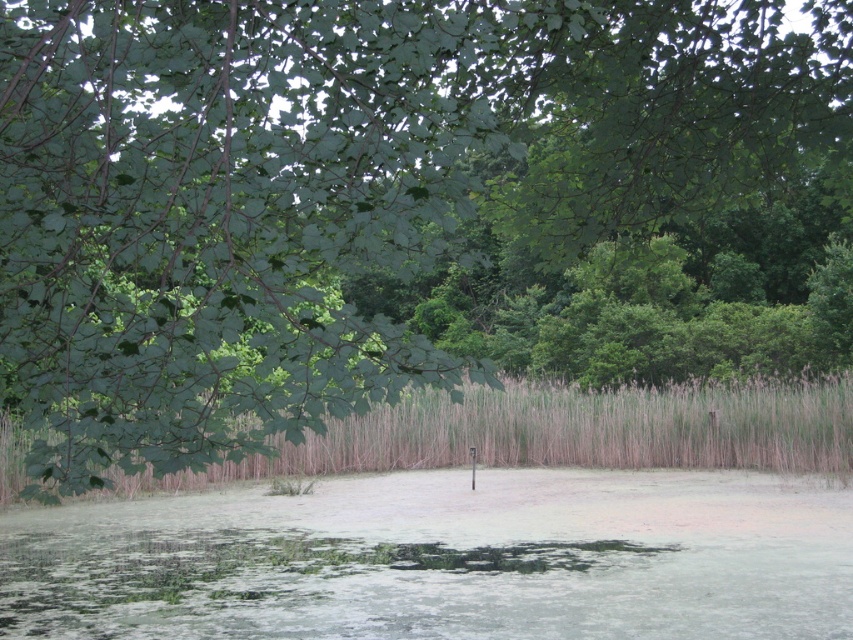
You are standing at the edge of the water in the scene. There is a point marked at coordinates (442, 560) which is green algae water at center. If you want to reach the dense cluster of reeds in the middle ground, should you walk towards that point or away from it?

The point marks green algae water at center, so to reach the dense cluster of reeds in the middle ground, you should walk away from that point towards the reeds.

You are a small frog trying to jump from a lily pad to the other side of the pond. The green algae water at center and brown grass at center are in your path. Which part of the path is narrower?

The green algae water at center has a lesser width compared to brown grass at center, so the green algae water at center is narrower.

You are a photographer planning to take a picture of the green algae water at center and the brown grass at center. Which object is located closer to the camera in the image?

The brown grass at center is closer to the camera because it is positioned over the green algae water at center.